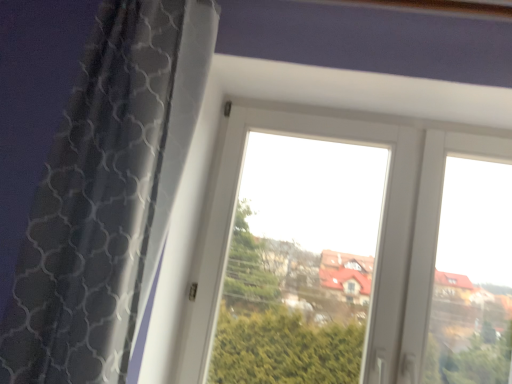
Question: Considering the relative sizes of transparent glass window at center and black mesh curtain at left in the image provided, is transparent glass window at center smaller than black mesh curtain at left?

Choices:
 (A) no
 (B) yes

Answer: (A)

Question: Is transparent glass window at center wider than black mesh curtain at left?

Choices:
 (A) no
 (B) yes

Answer: (A)

Question: Is the depth of transparent glass window at center greater than that of black mesh curtain at left?

Choices:
 (A) yes
 (B) no

Answer: (A)

Question: Does transparent glass window at center have a lesser width compared to black mesh curtain at left?

Choices:
 (A) yes
 (B) no

Answer: (A)

Question: Could black mesh curtain at left be considered to be inside transparent glass window at center?

Choices:
 (A) no
 (B) yes

Answer: (A)

Question: From the image's perspective, does transparent glass window at center appear higher than black mesh curtain at left?

Choices:
 (A) no
 (B) yes

Answer: (A)

Question: Can you confirm if black mesh curtain at left is bigger than transparent glass window at center?

Choices:
 (A) no
 (B) yes

Answer: (A)

Question: From the image's perspective, is black mesh curtain at left on transparent glass window at center?

Choices:
 (A) no
 (B) yes

Answer: (B)

Question: Does black mesh curtain at left lie in front of transparent glass window at center?

Choices:
 (A) yes
 (B) no

Answer: (A)

Question: Is black mesh curtain at left at the right side of transparent glass window at center?

Choices:
 (A) no
 (B) yes

Answer: (A)

Question: From a real-world perspective, is black mesh curtain at left below transparent glass window at center?

Choices:
 (A) yes
 (B) no

Answer: (B)

Question: Is black mesh curtain at left outside transparent glass window at center?

Choices:
 (A) no
 (B) yes

Answer: (B)

Question: From a real-world perspective, is black mesh curtain at left physically located above or below transparent glass window at center?

Choices:
 (A) below
 (B) above

Answer: (B)